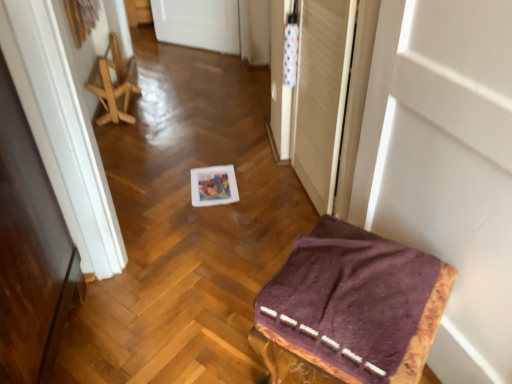
Question: Is transparent plastic screen door at upper right in front of or behind purple fabric-covered stool at lower right, acting as the 2th furniture starting from the left, in the image?

Choices:
 (A) front
 (B) behind

Answer: (B)

Question: Does point (349, 31) appear closer or farther from the camera than point (311, 289)?

Choices:
 (A) closer
 (B) farther

Answer: (B)

Question: Which of these objects is positioned farthest from the purple fabric-covered stool at lower right, the first furniture positioned from the front?

Choices:
 (A) transparent plastic screen door at upper right
 (B) white matte door at upper right
 (C) wooden folding chair at left, the first furniture in the top-to-bottom sequence

Answer: (C)

Question: Which of these objects is positioned closest to the wooden folding chair at left, the first furniture in the top-to-bottom sequence?

Choices:
 (A) white matte door at upper right
 (B) purple fabric-covered stool at lower right, which appears as the 1th furniture when ordered from the bottom
 (C) transparent plastic screen door at upper right

Answer: (C)